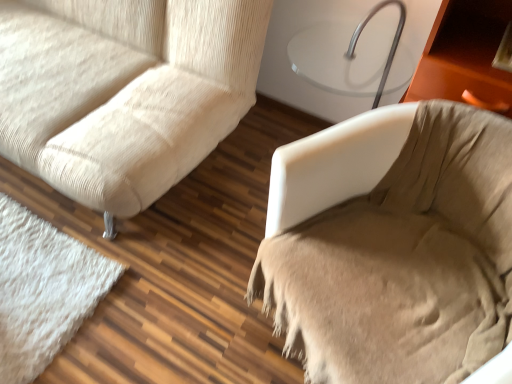
Question: Looking at their shapes, would you say beige fabric chair at right is wider or thinner than beige textured fabric couch at left?

Choices:
 (A) wide
 (B) thin

Answer: (B)

Question: From their relative heights in the image, would you say beige fabric chair at right is taller or shorter than beige textured fabric couch at left?

Choices:
 (A) tall
 (B) short

Answer: (B)

Question: Is beige fabric chair at right situated inside beige textured fabric couch at left or outside?

Choices:
 (A) inside
 (B) outside

Answer: (B)

Question: In terms of height, does beige textured fabric couch at left look taller or shorter compared to beige fabric chair at right?

Choices:
 (A) tall
 (B) short

Answer: (A)

Question: From a real-world perspective, relative to beige fabric chair at right, is beige textured fabric couch at left vertically above or below?

Choices:
 (A) above
 (B) below

Answer: (A)

Question: Which is correct: beige textured fabric couch at left is inside beige fabric chair at right, or outside of it?

Choices:
 (A) outside
 (B) inside

Answer: (A)

Question: From the image's perspective, is beige textured fabric couch at left positioned above or below beige fabric chair at right?

Choices:
 (A) below
 (B) above

Answer: (B)